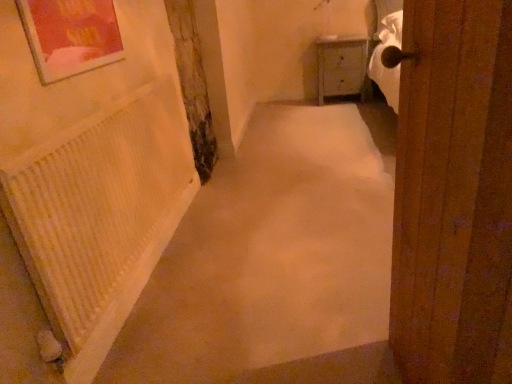
Question: Considering the relative sizes of white wood cabinet at upper right and white textured radiator at left in the image provided, is white wood cabinet at upper right bigger than white textured radiator at left?

Choices:
 (A) yes
 (B) no

Answer: (A)

Question: Is white wood cabinet at upper right smaller than white textured radiator at left?

Choices:
 (A) no
 (B) yes

Answer: (A)

Question: From the image's perspective, does white wood cabinet at upper right appear lower than white textured radiator at left?

Choices:
 (A) yes
 (B) no

Answer: (B)

Question: Is white wood cabinet at upper right in contact with white textured radiator at left?

Choices:
 (A) no
 (B) yes

Answer: (A)

Question: Is white wood cabinet at upper right further to the viewer compared to white textured radiator at left?

Choices:
 (A) no
 (B) yes

Answer: (B)

Question: From a real-world perspective, is white textured radiator at left positioned above or below beige carpet at center?

Choices:
 (A) below
 (B) above

Answer: (B)

Question: From their relative heights in the image, would you say white textured radiator at left is taller or shorter than beige carpet at center?

Choices:
 (A) tall
 (B) short

Answer: (A)

Question: Does point coord(150,192) appear closer or farther from the camera than point coord(365,192)?

Choices:
 (A) farther
 (B) closer

Answer: (B)

Question: Would you say white textured radiator at left is to the left or to the right of beige carpet at center in the picture?

Choices:
 (A) left
 (B) right

Answer: (A)

Question: From a real-world perspective, is beige carpet at center above or below white wood cabinet at upper right?

Choices:
 (A) below
 (B) above

Answer: (A)

Question: From their relative heights in the image, would you say beige carpet at center is taller or shorter than white wood cabinet at upper right?

Choices:
 (A) short
 (B) tall

Answer: (A)

Question: Visually, is beige carpet at center positioned to the left or to the right of white wood cabinet at upper right?

Choices:
 (A) left
 (B) right

Answer: (A)

Question: In terms of size, does beige carpet at center appear bigger or smaller than white wood cabinet at upper right?

Choices:
 (A) big
 (B) small

Answer: (A)

Question: Is wooden door at right to the left or to the right of beige carpet at center in the image?

Choices:
 (A) left
 (B) right

Answer: (A)

Question: Does point (408, 349) appear closer or farther from the camera than point (151, 331)?

Choices:
 (A) closer
 (B) farther

Answer: (A)